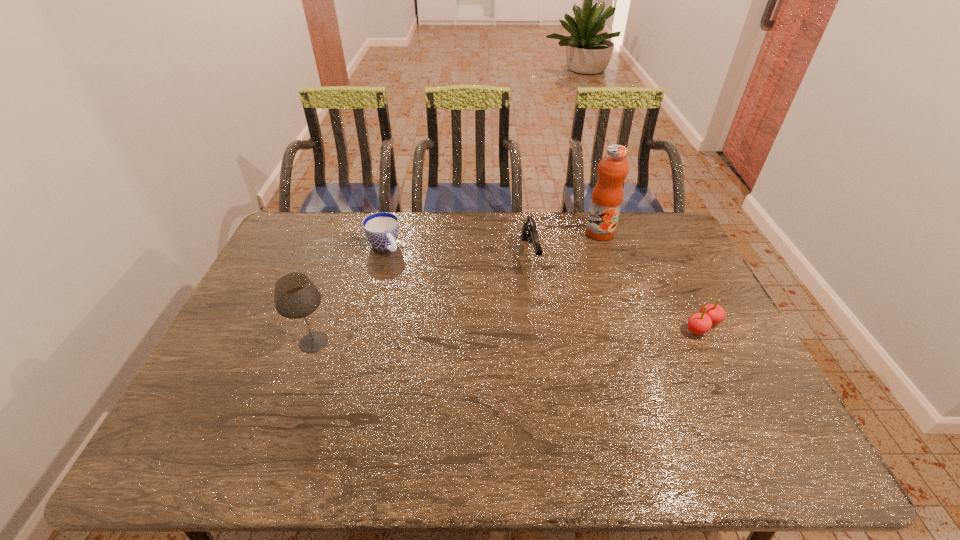
Where is `object that can be found as the third closest to the cherry`? This screenshot has width=960, height=540. object that can be found as the third closest to the cherry is located at coordinates (381, 229).

Where is `vacant space that satisfies the following two spatial constraints: 1. on the back side of the tallest object; 2. on the right side of the wineglass`? vacant space that satisfies the following two spatial constraints: 1. on the back side of the tallest object; 2. on the right side of the wineglass is located at coordinates (353, 233).

Identify the location of vacant area that satisfies the following two spatial constraints: 1. on the back side of the fourth shortest object; 2. on the right side of the cherry. (319, 327).

You are a GUI agent. You are given a task and a screenshot of the screen. Output one action in this format:
    pyautogui.click(x=<x>, y=<y>)
    Task: Click on the free space in the image that satisfies the following two spatial constraints: 1. on the back side of the gun; 2. on the left side of the second tallest object
    The width and height of the screenshot is (960, 540).
    Given the screenshot: What is the action you would take?
    pyautogui.click(x=345, y=255)